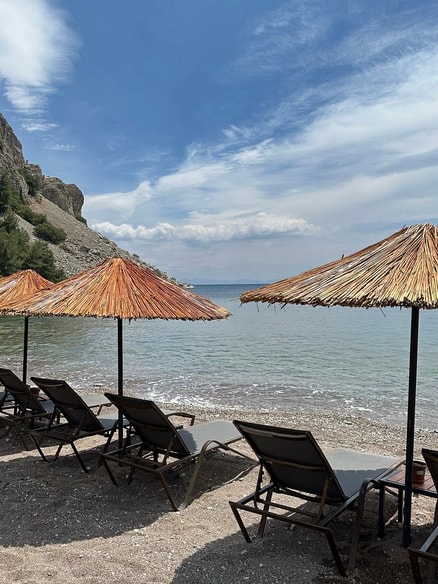
Locate an element on the screen. lounge chair backs is located at coordinates (155, 424), (76, 404), (27, 396), (286, 458).